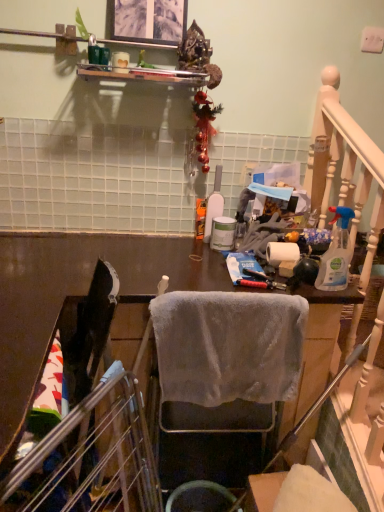
Question: From the image's perspective, relative to white matte bottle at center, the 1th bottle positioned from the left, is metallic gold ornament at upper center above or below?

Choices:
 (A) above
 (B) below

Answer: (A)

Question: From a real-world perspective, is metallic gold ornament at upper center positioned above or below white matte bottle at center, arranged as the 2th bottle when viewed from the front?

Choices:
 (A) above
 (B) below

Answer: (A)

Question: Based on their relative distances, which object is farther from the metallic gold ornament at upper center?

Choices:
 (A) gray fabric chair at center
 (B) metallic silver picture frame at upper center
 (C) white matte toilet paper at center
 (D) clear plastic spray bottle at right, which ranks as the first bottle in front-to-back order
 (E) white matte bottle at center, the 1th bottle positioned from the back

Answer: (A)

Question: Based on their relative distances, which object is farther from the white matte bottle at center, arranged as the 2th bottle when viewed from the front?

Choices:
 (A) clear plastic spray bottle at right, which ranks as the first bottle in front-to-back order
 (B) white matte toilet paper at center
 (C) gray fabric chair at center
 (D) metallic gold ornament at upper center
 (E) metallic silver picture frame at upper center

Answer: (C)